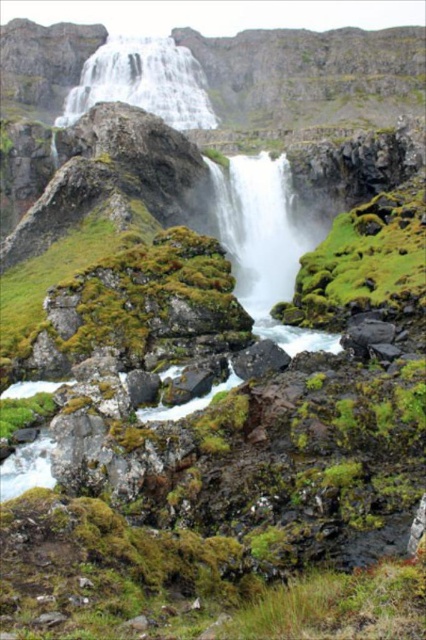
Is point (241, 296) positioned behind point (123, 54)?

No, it is not.

Describe the element at coordinates (259, 228) in the screenshot. I see `white smooth waterfall at center` at that location.

What do you see at coordinates (259, 228) in the screenshot?
I see `white smooth waterfall at center` at bounding box center [259, 228].

I want to click on white smooth waterfall at center, so click(259, 228).

Does green mossy rock at center appear on the right side of white smooth waterfall at center?

Correct, you'll find green mossy rock at center to the right of white smooth waterfall at center.

Locate an element on the screen. This screenshot has width=426, height=640. green mossy rock at center is located at coordinates (363, 262).

In the scene shown: Who is more forward, (414, 259) or (94, 77)?

Point (414, 259) is in front.

Which is behind, point (406, 259) or point (85, 92)?

The point (85, 92) is more distant.

This screenshot has height=640, width=426. Find the location of `green mossy rock at center`. green mossy rock at center is located at coordinates (363, 262).